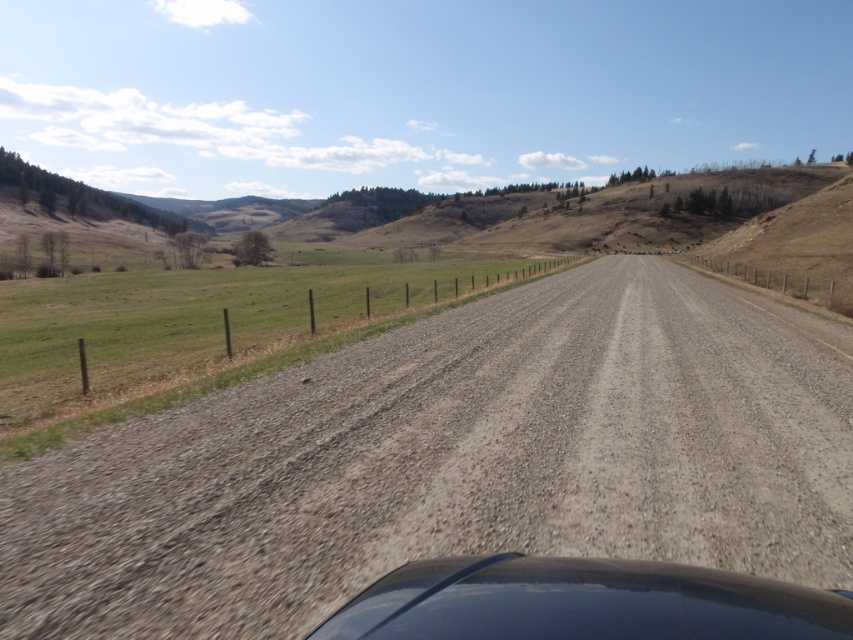
Question: Which point is closer to the camera?

Choices:
 (A) gray gravel road at center
 (B) glossy black car at center

Answer: (B)

Question: Observing the image, what is the correct spatial positioning of gray gravel road at center in reference to glossy black car at center?

Choices:
 (A) left
 (B) right

Answer: (B)

Question: Which of the following is the farthest from the observer?

Choices:
 (A) glossy black car at center
 (B) gray gravel road at center

Answer: (B)

Question: Is gray gravel road at center above glossy black car at center?

Choices:
 (A) yes
 (B) no

Answer: (A)

Question: Can you confirm if gray gravel road at center is smaller than glossy black car at center?

Choices:
 (A) no
 (B) yes

Answer: (A)